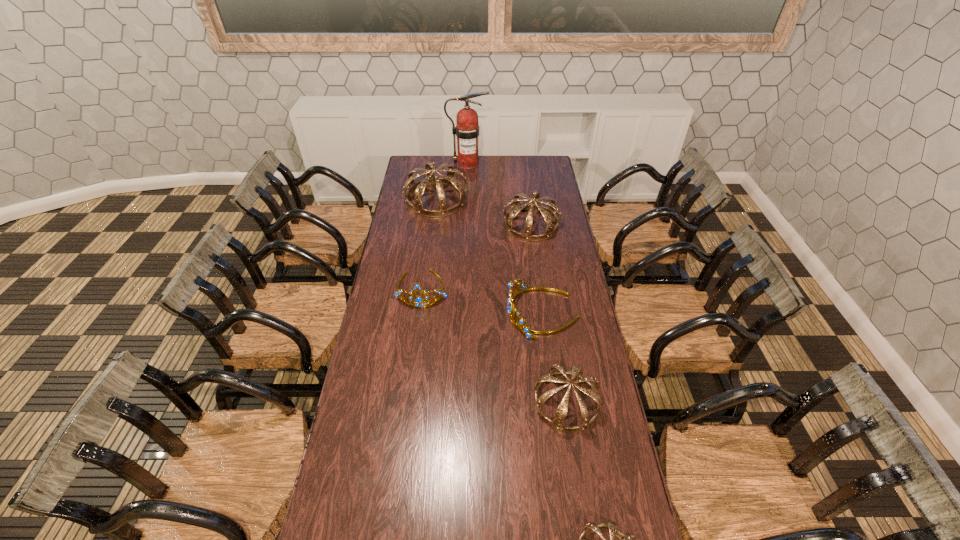
Image resolution: width=960 pixels, height=540 pixels. Find the location of `free space at the right edge of the desktop`. free space at the right edge of the desktop is located at coordinates (565, 252).

Identify the location of free region at the far right corner. Image resolution: width=960 pixels, height=540 pixels. (552, 173).

Identify the location of vacant area that lies between the second nearest object and the third smallest brown tiara. (548, 314).

The image size is (960, 540). What are the coordinates of `vacant area that lies between the red fire extinguisher and the left gold tiara` in the screenshot? It's located at (445, 226).

The width and height of the screenshot is (960, 540). What are the coordinates of `empty space between the smaller gold tiara and the second biggest brown tiara` in the screenshot? It's located at (477, 256).

Identify the location of free area in between the second biggest brown tiara and the right gold tiara. (537, 269).

Locate which object is the closest to the tallest tiara. Please provide its 2D coordinates. Your answer should be formatted as a tuple, i.e. [(x, y)], where the tuple contains the x and y coordinates of a point satisfying the conditions above.

[(467, 130)]

Select which object is the closest to the right gold tiara. Please provide its 2D coordinates. Your answer should be formatted as a tuple, i.e. [(x, y)], where the tuple contains the x and y coordinates of a point satisfying the conditions above.

[(576, 371)]

Identify the location of the closest tiara to the smaller gold tiara. This screenshot has height=540, width=960. (519, 322).

Locate an element on the screen. The width and height of the screenshot is (960, 540). tiara identified as the fifth closest to the shortest tiara is located at coordinates (418, 188).